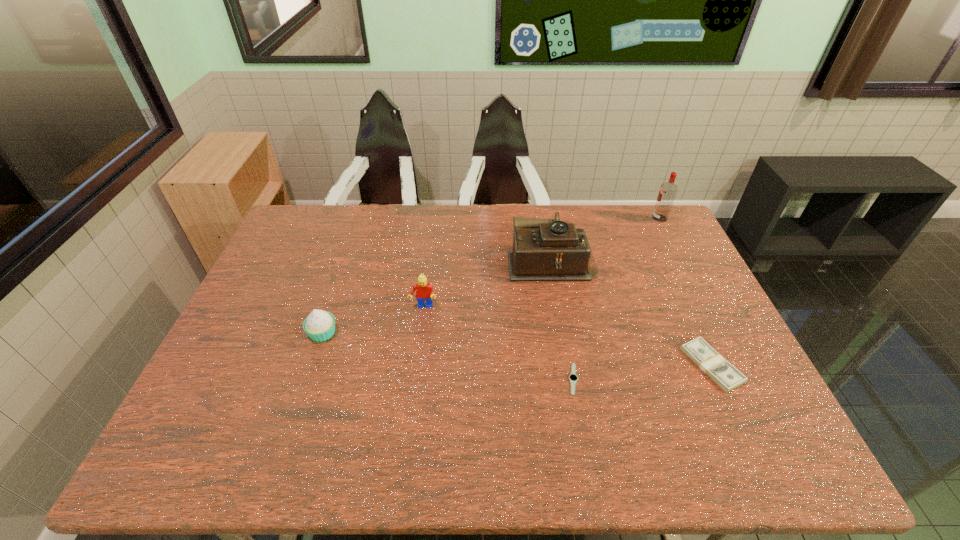
You are a GUI agent. You are given a task and a screenshot of the screen. Output one action in this format:
    pyautogui.click(x=<x>, y=<y>)
    Task: Click on the vodka
    This screenshot has height=540, width=960.
    Given the screenshot: What is the action you would take?
    pyautogui.click(x=668, y=190)

In order to click on the farthest object in this screenshot , I will do `click(668, 190)`.

In order to click on the second tallest object in this screenshot , I will do `click(543, 249)`.

What are the coordinates of `the fifth nearest object` in the screenshot? It's located at (543, 249).

Image resolution: width=960 pixels, height=540 pixels. What are the coordinates of `the second object from left to right` in the screenshot? It's located at (424, 292).

At what (x,y) coordinates should I click in order to perform the action: click on the fourth nearest object. Please return your answer as a coordinate pair (x, y). The height and width of the screenshot is (540, 960). Looking at the image, I should click on (424, 292).

The height and width of the screenshot is (540, 960). In order to click on the leftmost object in this screenshot , I will do `click(319, 325)`.

At what (x,y) coordinates should I click in order to perform the action: click on cupcake. Please return your answer as a coordinate pair (x, y). Looking at the image, I should click on (319, 325).

The height and width of the screenshot is (540, 960). Find the location of `the fifth tallest object`. the fifth tallest object is located at coordinates (726, 376).

Locate an element on the screen. The width and height of the screenshot is (960, 540). watch is located at coordinates (573, 378).